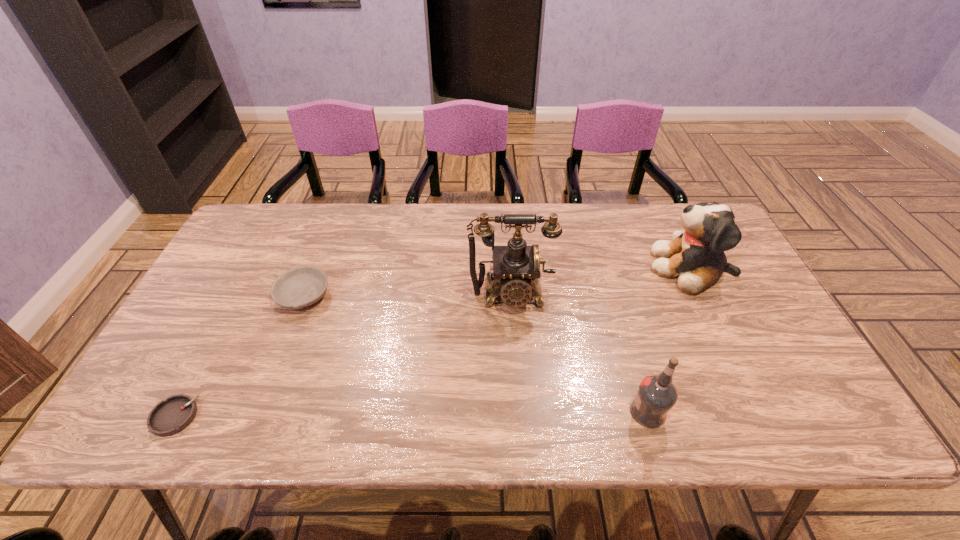
Locate an element on the screen. vacant space positioned at the face of the rightmost object is located at coordinates (575, 267).

At what (x,y) coordinates should I click in order to perform the action: click on vacant space located at the face of the rightmost object. Please return your answer as a coordinate pair (x, y). The width and height of the screenshot is (960, 540). Looking at the image, I should click on (531, 267).

The height and width of the screenshot is (540, 960). I want to click on vacant space located 0.290m on the front label of the vodka, so click(x=499, y=412).

Locate an element on the screen. vacant space located on the front label of the vodka is located at coordinates (566, 412).

The image size is (960, 540). In order to click on free spot located 0.140m on the front label of the vodka in this screenshot , I will do `click(566, 412)`.

This screenshot has width=960, height=540. In order to click on vacant space located on the left of the fourth tallest object in this screenshot , I will do `click(202, 296)`.

Find the location of a particular element. This screenshot has width=960, height=540. free space located 0.140m on the right of the leftmost object is located at coordinates (260, 417).

Find the location of a particular element. object that is at the far edge is located at coordinates (696, 257).

Locate an element on the screen. The height and width of the screenshot is (540, 960). vodka that is positioned at the near edge is located at coordinates pos(656,396).

Where is `ashtray positioned at the near edge`? Image resolution: width=960 pixels, height=540 pixels. ashtray positioned at the near edge is located at coordinates (171, 416).